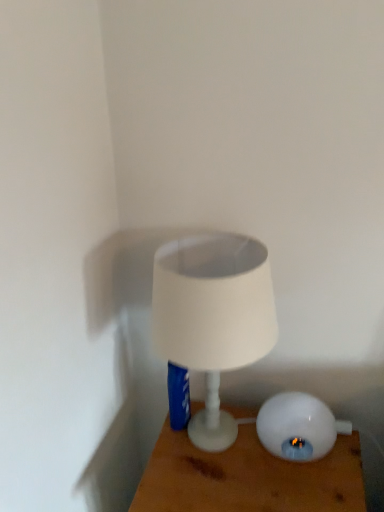
Question: From the image's perspective, would you say white glossy lamp at lower right, the second lamp from the left, is shown under white glossy lamp at center?

Choices:
 (A) no
 (B) yes

Answer: (A)

Question: Does white glossy lamp at lower right, the first lamp in the right-to-left sequence, have a greater height compared to white glossy lamp at center?

Choices:
 (A) no
 (B) yes

Answer: (A)

Question: Is white glossy lamp at lower right, the first lamp in the right-to-left sequence, turned away from white glossy lamp at center?

Choices:
 (A) no
 (B) yes

Answer: (A)

Question: From a real-world perspective, is white glossy lamp at lower right, the second lamp from the left, positioned under white glossy lamp at center based on gravity?

Choices:
 (A) yes
 (B) no

Answer: (B)

Question: Is white glossy lamp at lower right, the second lamp from the left, further to the viewer compared to white glossy lamp at center?

Choices:
 (A) yes
 (B) no

Answer: (A)

Question: Is white glossy lamp at lower right, the first lamp in the right-to-left sequence, not near white glossy lamp at center?

Choices:
 (A) yes
 (B) no

Answer: (B)

Question: Is white matte lampshade at center, the 2th lamp when ordered from right to left, smaller than white glossy lamp at center?

Choices:
 (A) yes
 (B) no

Answer: (A)

Question: From a real-world perspective, is white matte lampshade at center, the 2th lamp when ordered from right to left, beneath white glossy lamp at center?

Choices:
 (A) no
 (B) yes

Answer: (A)

Question: Is white matte lampshade at center, the 2th lamp when ordered from right to left, facing away from white glossy lamp at center?

Choices:
 (A) no
 (B) yes

Answer: (A)

Question: Does white matte lampshade at center, acting as the first lamp starting from the left, have a lesser width compared to white glossy lamp at center?

Choices:
 (A) yes
 (B) no

Answer: (A)

Question: Can you see white matte lampshade at center, acting as the first lamp starting from the left, touching white glossy lamp at center?

Choices:
 (A) no
 (B) yes

Answer: (A)

Question: Does white matte lampshade at center, the 2th lamp when ordered from right to left, have a greater width compared to white glossy lamp at center?

Choices:
 (A) no
 (B) yes

Answer: (A)

Question: From a real-world perspective, is white matte lampshade at center, acting as the first lamp starting from the left, over white glossy lamp at lower right, the second lamp from the left?

Choices:
 (A) yes
 (B) no

Answer: (A)